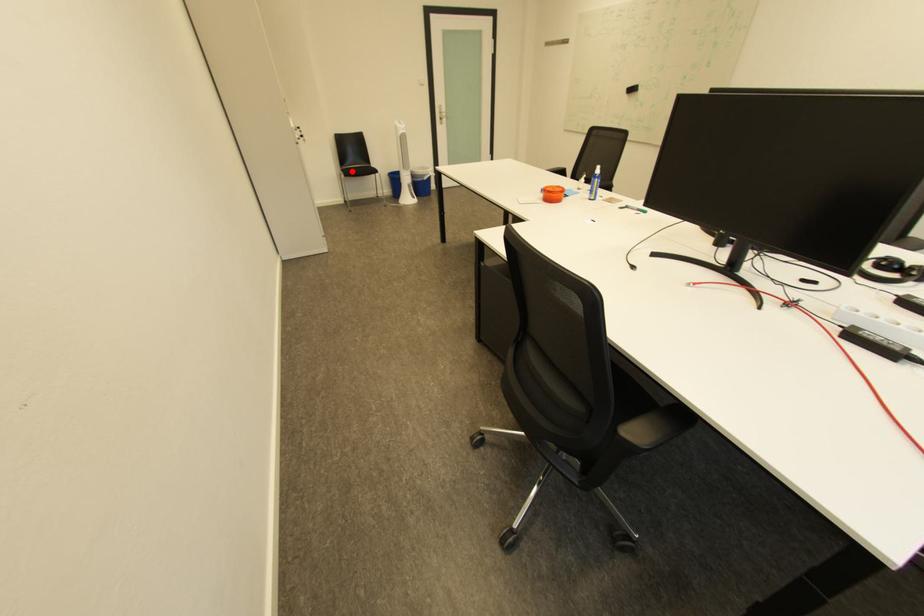
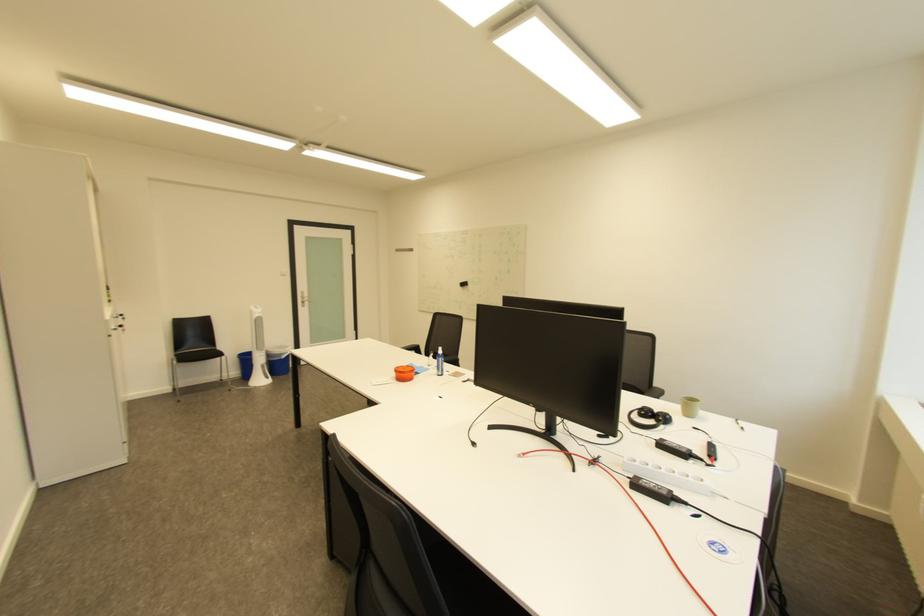
Question: I am providing you with two images of the same scene from different viewpoints. In image1, a red point is highlighted. Considering the same 3D point in image2, which of the following is correct?

Choices:
 (A) It is closer
 (B) It is farther

Answer: (B)